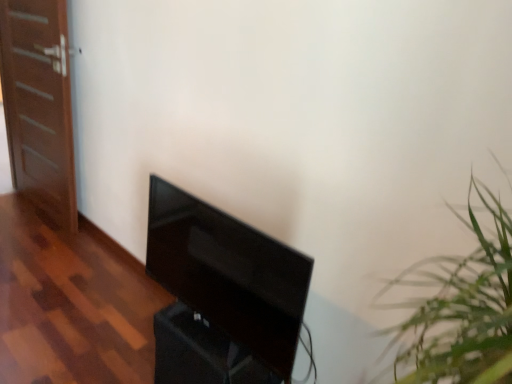
Locate an element on the screen. vacant area that lies in front of brown wooden door at left is located at coordinates (33, 237).